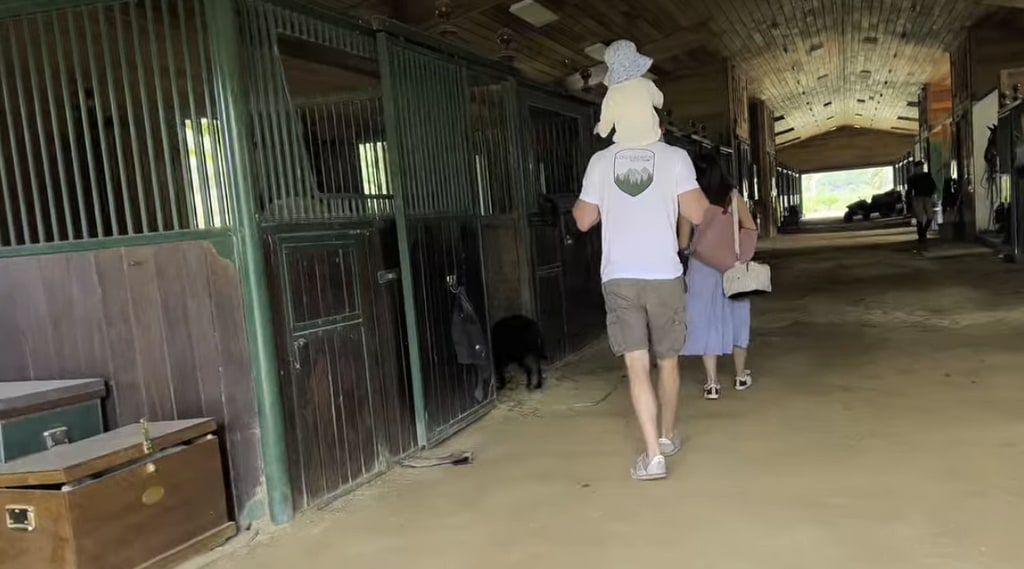
Locate an element on the screen. This screenshot has height=569, width=1024. storage chest is located at coordinates coord(133,504).